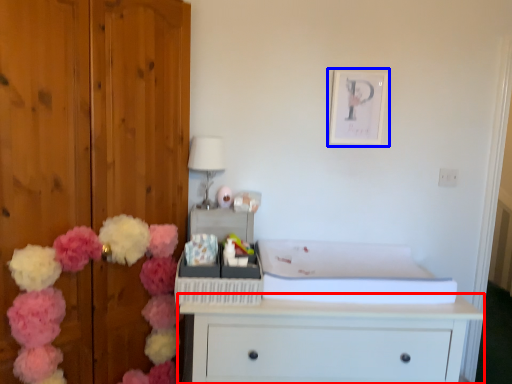
Question: Which point is further to the camera, chest of drawers (highlighted by a red box) or picture frame (highlighted by a blue box)?

Choices:
 (A) chest of drawers
 (B) picture frame

Answer: (B)